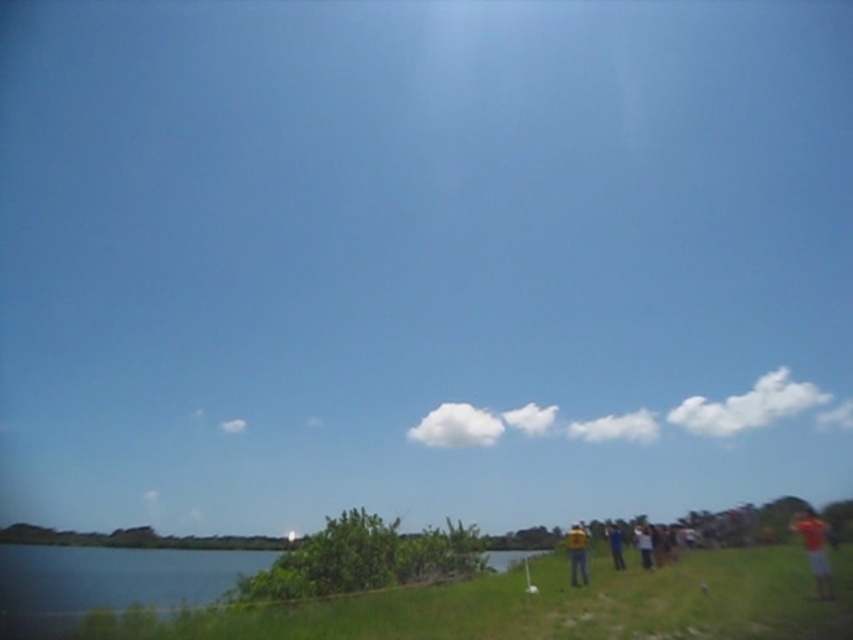
You are standing at the edge of the water and see the yellow fabric person at lower right and the yellow shirt at lower right. Which one appears to be wider from your current viewpoint?

The yellow shirt at lower right appears wider than the yellow fabric person at lower right.